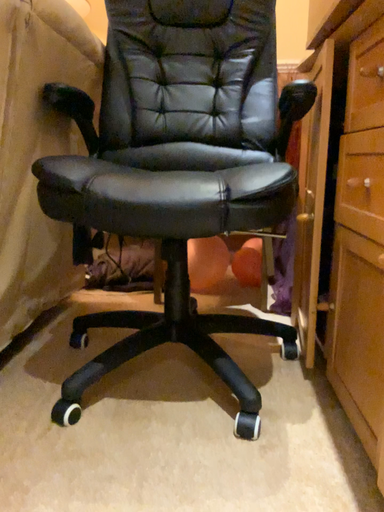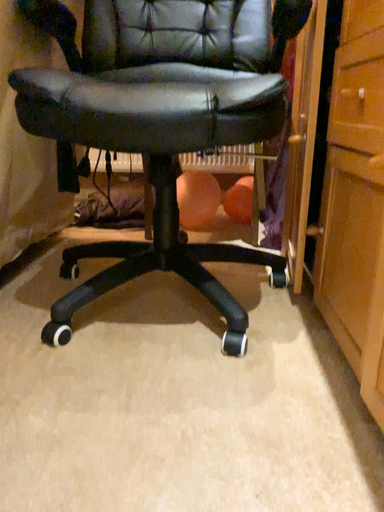
Question: Which way did the camera rotate in the video?

Choices:
 (A) rotated downward
 (B) rotated upward

Answer: (A)